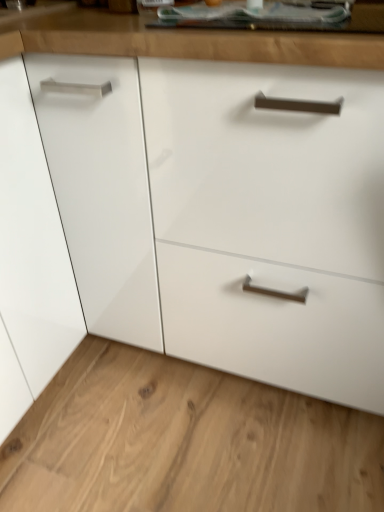
Question: Considering the relative positions of white glossy drawer at lower right and glossy wood counter top at upper center in the image provided, is white glossy drawer at lower right to the left or to the right of glossy wood counter top at upper center?

Choices:
 (A) right
 (B) left

Answer: (B)

Question: From a real-world perspective, is white glossy drawer at lower right above or below glossy wood counter top at upper center?

Choices:
 (A) above
 (B) below

Answer: (B)

Question: Is white glossy drawer at lower right in front of or behind glossy wood counter top at upper center in the image?

Choices:
 (A) front
 (B) behind

Answer: (B)

Question: Considering the relative positions of glossy wood counter top at upper center and white glossy drawer at lower right in the image provided, is glossy wood counter top at upper center to the left or to the right of white glossy drawer at lower right?

Choices:
 (A) left
 (B) right

Answer: (B)

Question: Does point (221, 46) appear closer or farther from the camera than point (206, 463)?

Choices:
 (A) farther
 (B) closer

Answer: (B)

Question: Is glossy wood counter top at upper center situated inside white glossy drawer at lower right or outside?

Choices:
 (A) outside
 (B) inside

Answer: (A)

Question: In terms of height, does glossy wood counter top at upper center look taller or shorter compared to white glossy drawer at lower right?

Choices:
 (A) short
 (B) tall

Answer: (B)